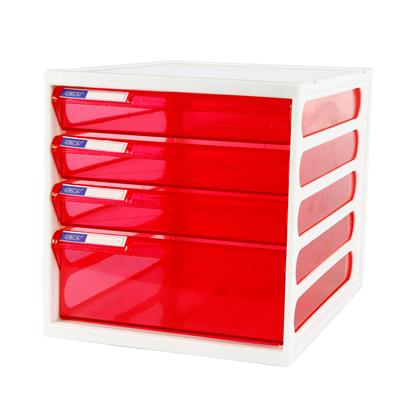
Locate an element on the screen. red drawers is located at coordinates pos(219,121), pos(213,161), pos(219,215), pos(200,278).